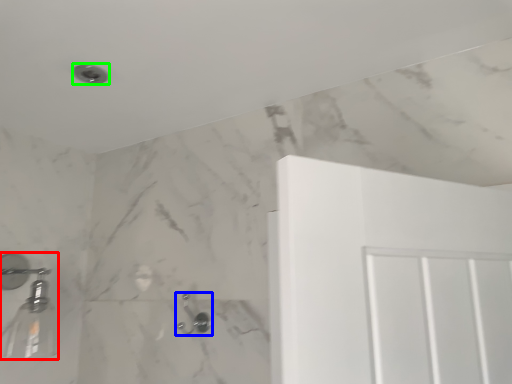
Question: Considering the real-world distances, which object is closest to shower (highlighted by a red box)? shower (highlighted by a blue box) or shower (highlighted by a green box).

Choices:
 (A) shower
 (B) shower

Answer: (A)